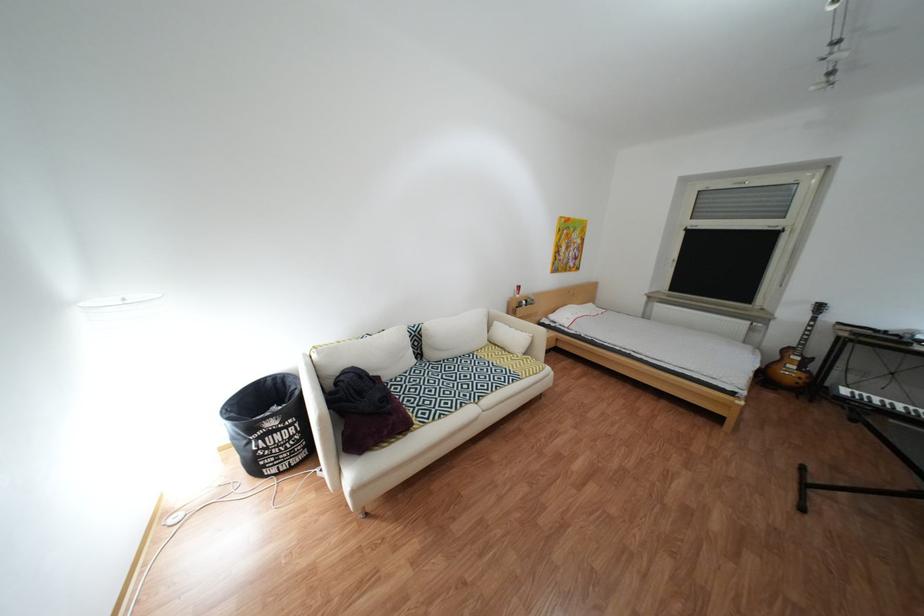
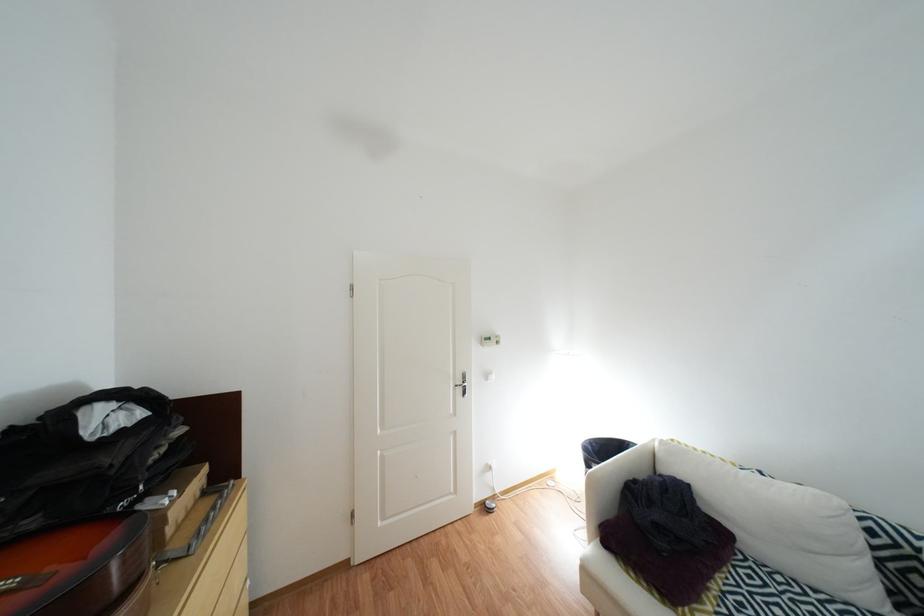
In the second image, find the point that corresponds to (x=418, y=387) in the first image.

(782, 586)